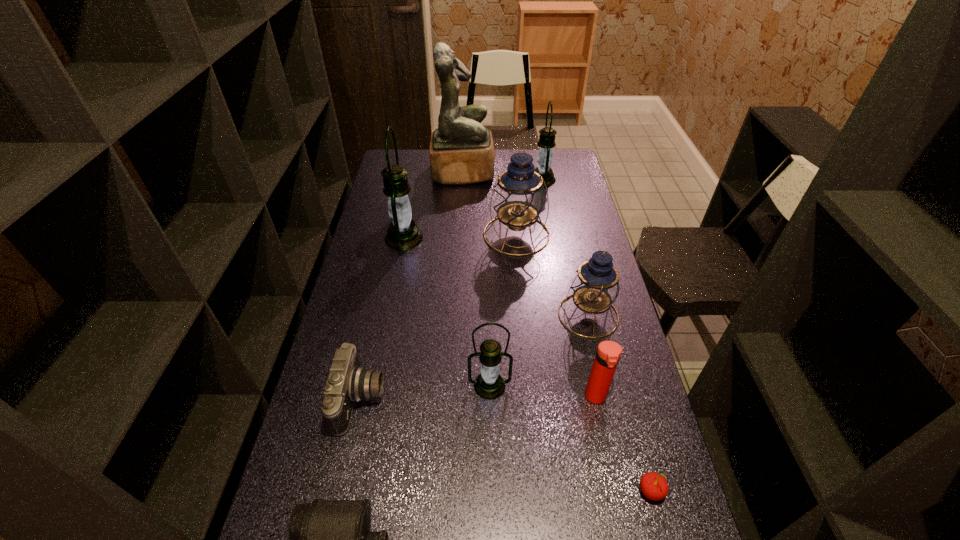
Locate an element on the screen. thermos bottle is located at coordinates (608, 353).

Where is `camera`? This screenshot has height=540, width=960. camera is located at coordinates (347, 383).

This screenshot has width=960, height=540. Identify the location of black camera. (347, 383).

The image size is (960, 540). I want to click on red cherry, so click(x=654, y=486).

I want to click on the second shortest object, so click(654, 486).

The width and height of the screenshot is (960, 540). What are the coordinates of `vacant area located in a relaxed pose on the tallest object` in the screenshot? It's located at (511, 172).

Identify the location of vacant region located on the side where the biggest green lantern emits light. (454, 238).

The width and height of the screenshot is (960, 540). I want to click on vacant space located 0.400m on the side where the farthest lantern emits light, so (x=442, y=179).

At what (x,y) coordinates should I click in order to perform the action: click on vacant space located on the side where the farthest lantern emits light. Please return your answer as a coordinate pair (x, y). Looking at the image, I should click on (481, 179).

The width and height of the screenshot is (960, 540). I want to click on vacant region located on the side where the farthest lantern emits light, so click(x=510, y=179).